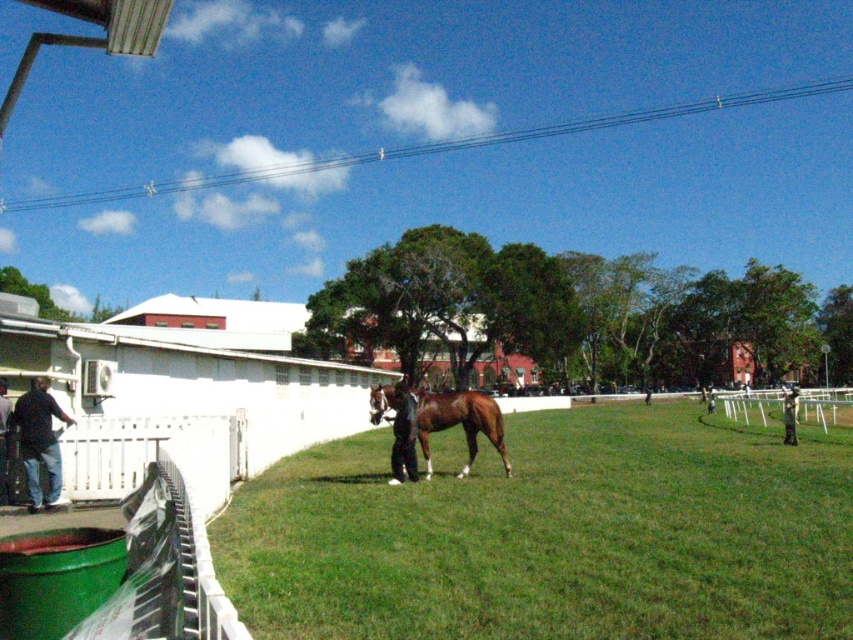
Does jeans at left appear on the left side of white plastic fence at lower right?

Yes, jeans at left is to the left of white plastic fence at lower right.

Between point (62, 497) and point (804, 403), which one is positioned in front?

Point (62, 497) is in front.

Where is `jeans at left`? The width and height of the screenshot is (853, 640). jeans at left is located at coordinates (39, 442).

How distant is green grass at center from dark blue suit at center?

green grass at center is 27.90 feet away from dark blue suit at center.

Identify the location of green grass at center. Image resolution: width=853 pixels, height=640 pixels. (553, 532).

Can you confirm if green grass at center is taller than white plastic fence at lower right?

Incorrect, green grass at center's height is not larger of white plastic fence at lower right's.

Does green grass at center have a lesser height compared to white plastic fence at lower right?

Yes, green grass at center is shorter than white plastic fence at lower right.

Find the location of a particular element. The height and width of the screenshot is (640, 853). green grass at center is located at coordinates (553, 532).